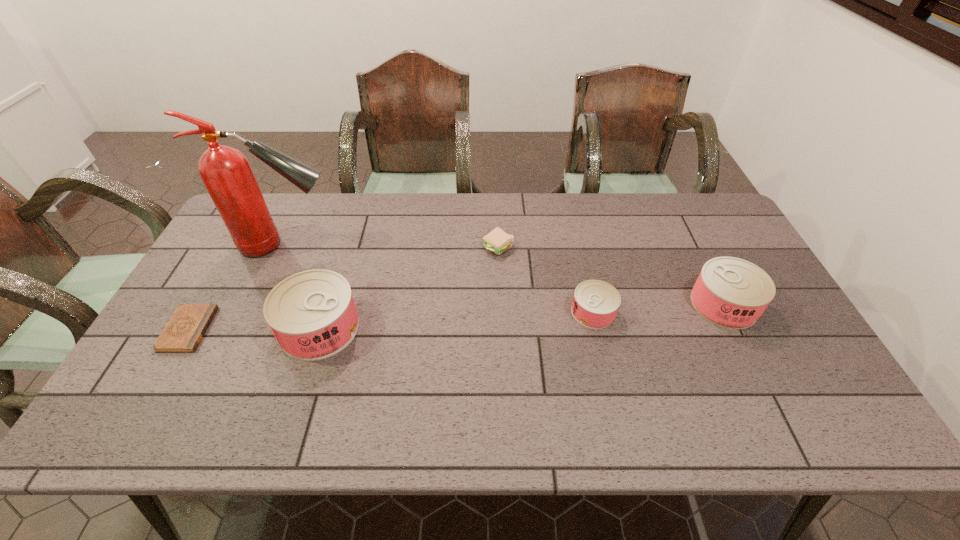
You are a GUI agent. You are given a task and a screenshot of the screen. Output one action in this format:
    pyautogui.click(x=<x>, y=<y>)
    Task: Click on the free location that satisfies the following two spatial constraints: 1. on the back side of the fourth object from left to right; 2. on the left side of the leftmost can
    
    Given the screenshot: What is the action you would take?
    pyautogui.click(x=345, y=248)

Where is `vacant point that satisfies the following two spatial constraints: 1. on the front side of the leftmost can; 2. on the spine side of the diary`? The image size is (960, 540). vacant point that satisfies the following two spatial constraints: 1. on the front side of the leftmost can; 2. on the spine side of the diary is located at coordinates (319, 329).

I want to click on vacant space that satisfies the following two spatial constraints: 1. at the nozzle end of the fire extinguisher; 2. on the back side of the second can from right to left, so click(x=255, y=312).

Locate an element on the screen. This screenshot has height=540, width=960. free spot that satisfies the following two spatial constraints: 1. on the front side of the fourth object from left to right; 2. on the spine side of the diary is located at coordinates (502, 329).

Identify the location of vacant region that satisfies the following two spatial constraints: 1. at the nozzle end of the fire extinguisher; 2. on the right side of the rightmost can. Image resolution: width=960 pixels, height=540 pixels. (258, 305).

I want to click on free space that satisfies the following two spatial constraints: 1. at the nozzle end of the fire extinguisher; 2. on the left side of the leftmost can, so click(x=248, y=328).

Image resolution: width=960 pixels, height=540 pixels. Identify the location of free region that satisfies the following two spatial constraints: 1. on the front side of the second can from right to left; 2. on the right side of the second shortest object. (501, 312).